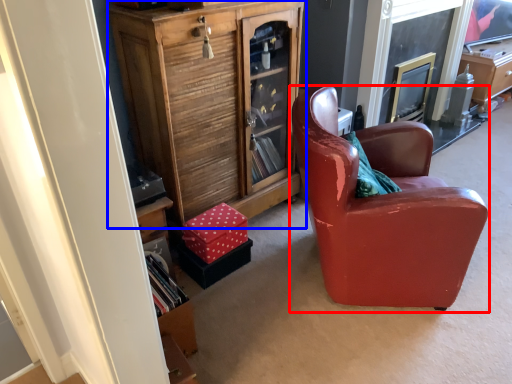
Question: Which object is closer to the camera taking this photo, chair (highlighted by a red box) or cabinetry (highlighted by a blue box)?

Choices:
 (A) chair
 (B) cabinetry

Answer: (A)